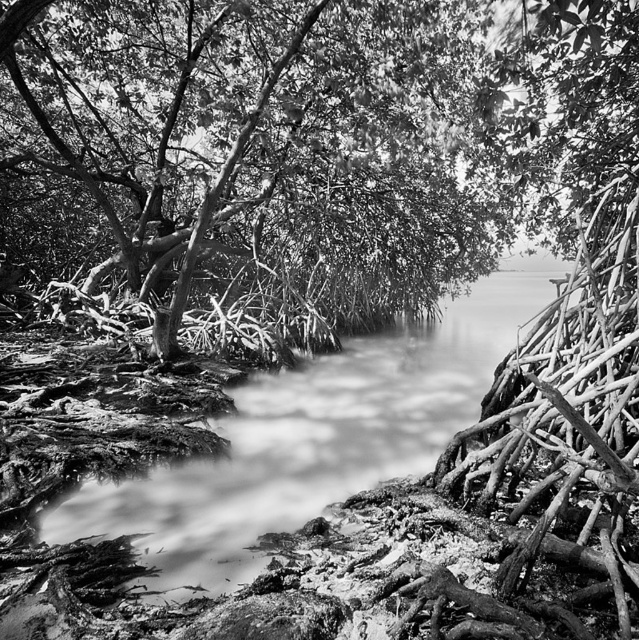
Question: Can you confirm if smooth bark tree at center is positioned below smooth mud stream at center?

Choices:
 (A) no
 (B) yes

Answer: (A)

Question: Which point is farther to the camera?

Choices:
 (A) 12,38
 (B) 116,513

Answer: (A)

Question: Can you confirm if smooth bark tree at center is wider than smooth mud stream at center?

Choices:
 (A) yes
 (B) no

Answer: (A)

Question: Which of the following is the closest to the observer?

Choices:
 (A) smooth bark tree at center
 (B) smooth mud stream at center

Answer: (B)

Question: Which point is closer to the camera?

Choices:
 (A) tap(520, 100)
 (B) tap(194, 556)

Answer: (B)

Question: Is smooth bark tree at center bigger than smooth mud stream at center?

Choices:
 (A) yes
 (B) no

Answer: (A)